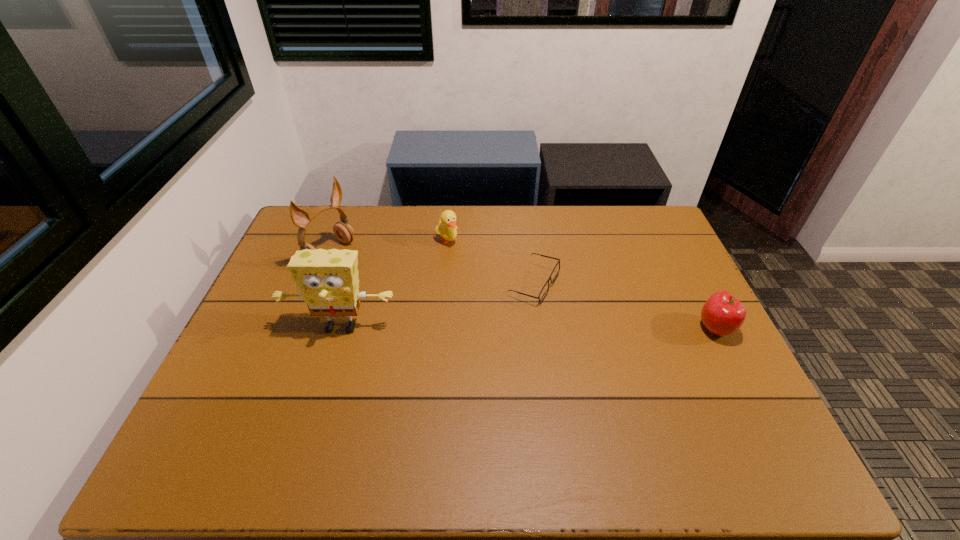
In order to click on free space on the desktop that is between the sponge and the rightmost object and is positioned on the front-facing side of the duckling in this screenshot , I will do `click(512, 328)`.

The image size is (960, 540). Identify the location of vacant space on the desktop that is between the sponge and the rightmost object and is positioned on the front-facing side of the earphone. (473, 327).

At what (x,y) coordinates should I click in order to perform the action: click on free space on the desktop that is between the sponge and the rightmost object and is positioned with the lenses facing outward on the shortest object. Please return your answer as a coordinate pair (x, y). The height and width of the screenshot is (540, 960). Looking at the image, I should click on (582, 328).